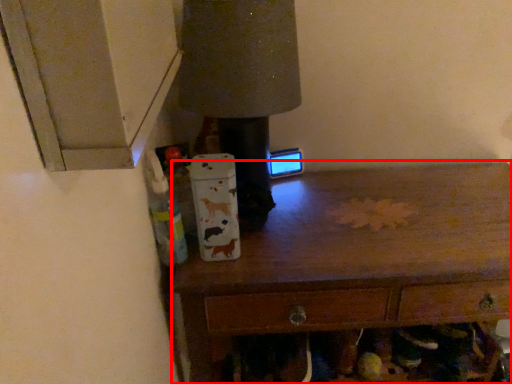
Question: Where is chest of drawers (annotated by the red box) located in relation to bottle in the image?

Choices:
 (A) right
 (B) left

Answer: (A)